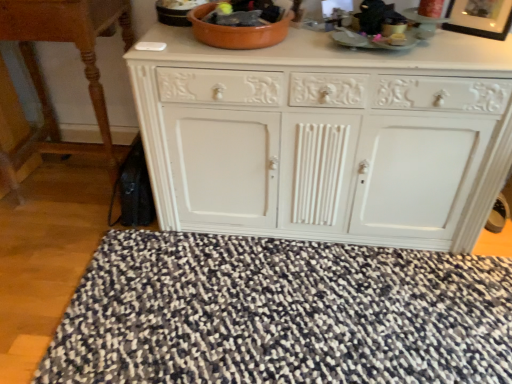
Question: From a real-world perspective, is speckled fabric doormat at lower center below white painted wood cabinet at center?

Choices:
 (A) no
 (B) yes

Answer: (B)

Question: Can you confirm if speckled fabric doormat at lower center is smaller than white painted wood cabinet at center?

Choices:
 (A) yes
 (B) no

Answer: (A)

Question: From the image's perspective, is speckled fabric doormat at lower center on white painted wood cabinet at center?

Choices:
 (A) no
 (B) yes

Answer: (A)

Question: Can you confirm if speckled fabric doormat at lower center is shorter than white painted wood cabinet at center?

Choices:
 (A) yes
 (B) no

Answer: (A)

Question: Is speckled fabric doormat at lower center far from white painted wood cabinet at center?

Choices:
 (A) no
 (B) yes

Answer: (A)

Question: Does point (330, 294) appear closer or farther from the camera than point (499, 29)?

Choices:
 (A) farther
 (B) closer

Answer: (A)

Question: Considering the positions of speckled fabric doormat at lower center and black glossy picture frame at upper right in the image, is speckled fabric doormat at lower center wider or thinner than black glossy picture frame at upper right?

Choices:
 (A) thin
 (B) wide

Answer: (B)

Question: Is speckled fabric doormat at lower center inside the boundaries of black glossy picture frame at upper right, or outside?

Choices:
 (A) inside
 (B) outside

Answer: (B)

Question: Considering the positions of speckled fabric doormat at lower center and black glossy picture frame at upper right in the image, is speckled fabric doormat at lower center taller or shorter than black glossy picture frame at upper right?

Choices:
 (A) short
 (B) tall

Answer: (A)

Question: Considering the positions of speckled fabric doormat at lower center and white painted wood cabinet at center in the image, is speckled fabric doormat at lower center taller or shorter than white painted wood cabinet at center?

Choices:
 (A) tall
 (B) short

Answer: (B)

Question: Considering the positions of point (227, 337) and point (361, 187), is point (227, 337) closer or farther from the camera than point (361, 187)?

Choices:
 (A) closer
 (B) farther

Answer: (A)

Question: Considering their positions, is speckled fabric doormat at lower center located in front of or behind white painted wood cabinet at center?

Choices:
 (A) front
 (B) behind

Answer: (A)

Question: Considering the positions of speckled fabric doormat at lower center and white painted wood cabinet at center in the image, is speckled fabric doormat at lower center bigger or smaller than white painted wood cabinet at center?

Choices:
 (A) big
 (B) small

Answer: (B)

Question: Relative to wooden table at left, is white painted wood cabinet at center in front or behind?

Choices:
 (A) front
 (B) behind

Answer: (A)

Question: From the image's perspective, relative to wooden table at left, is white painted wood cabinet at center above or below?

Choices:
 (A) above
 (B) below

Answer: (B)